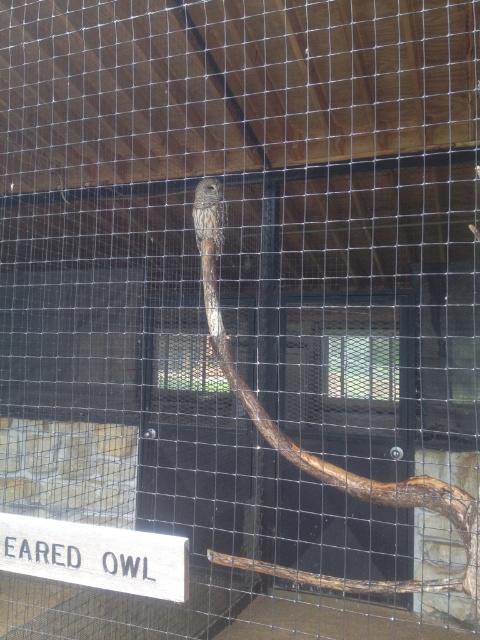
Question: Is white wood sign at lower left positioned behind brown speckled feathers at center?

Choices:
 (A) no
 (B) yes

Answer: (A)

Question: Which point is farther to the camera?

Choices:
 (A) (25, 544)
 (B) (255, 561)

Answer: (B)

Question: Which object is closer to the camera taking this photo?

Choices:
 (A) white wood sign at lower left
 (B) brown rough branch at center

Answer: (B)

Question: Does brown rough branch at center appear on the right side of brown speckled feathers at center?

Choices:
 (A) no
 (B) yes

Answer: (B)

Question: Which object appears closest to the camera in this image?

Choices:
 (A) white wood sign at lower left
 (B) brown speckled feathers at center

Answer: (A)

Question: Does white wood sign at lower left have a smaller size compared to brown speckled feathers at center?

Choices:
 (A) yes
 (B) no

Answer: (B)